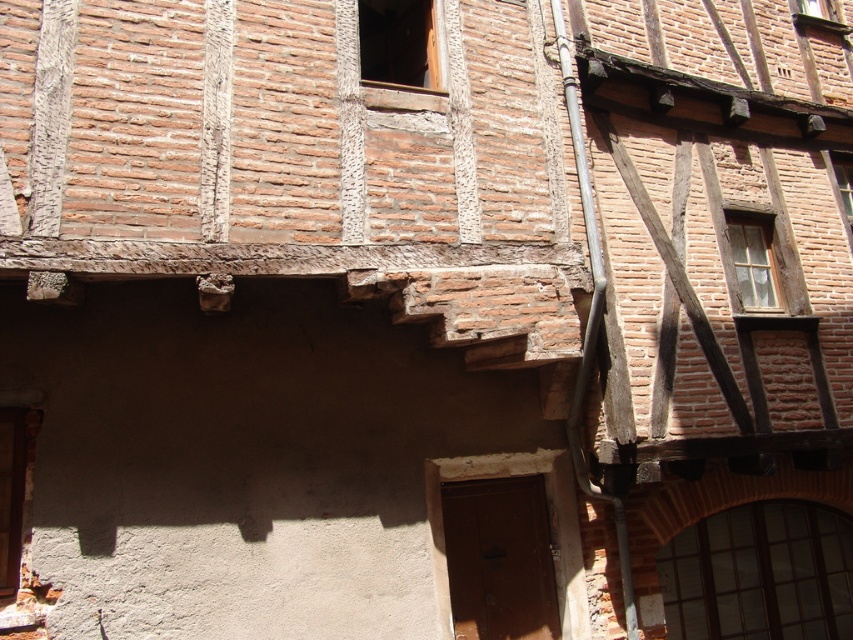
You are standing in front of a traditional half timbered building and see two points marked on the wall. The first point is at coordinates point (770, 625) and the second is at point (733, 241). Which point is closer to you?

Point (770, 625) is closer to the camera than point (733, 241).

You are an architect designing a new building inspired by traditional half timbered architecture. You want to ensure that the windows are spaced according to historical accuracy. Given the dark glass window at lower right and wooden frame window at upper right are 2.57 meters apart, what is the minimum distance you should maintain between these two window types in your design?

The minimum distance between the dark glass window at lower right and wooden frame window at upper right should be at least 2.57 meters to maintain historical accuracy based on the example provided.